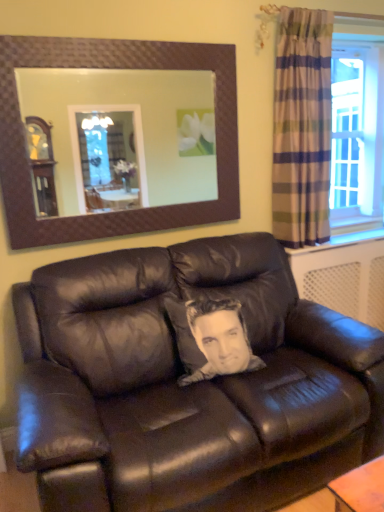
Question: Is brown textured mirror at upper center far away from plaid fabric curtain at right?

Choices:
 (A) no
 (B) yes

Answer: (B)

Question: Does brown textured mirror at upper center appear on the right side of plaid fabric curtain at right?

Choices:
 (A) yes
 (B) no

Answer: (B)

Question: Does brown textured mirror at upper center have a lesser height compared to plaid fabric curtain at right?

Choices:
 (A) yes
 (B) no

Answer: (A)

Question: Is brown textured mirror at upper center wider than plaid fabric curtain at right?

Choices:
 (A) no
 (B) yes

Answer: (A)

Question: Considering the relative positions of brown textured mirror at upper center and plaid fabric curtain at right in the image provided, is brown textured mirror at upper center in front of plaid fabric curtain at right?

Choices:
 (A) yes
 (B) no

Answer: (A)

Question: From the image's perspective, is brown textured mirror at upper center located above or below plaid fabric curtain at right?

Choices:
 (A) above
 (B) below

Answer: (B)

Question: Is brown textured mirror at upper center situated inside plaid fabric curtain at right or outside?

Choices:
 (A) outside
 (B) inside

Answer: (A)

Question: Visually, is brown textured mirror at upper center positioned to the left or to the right of plaid fabric curtain at right?

Choices:
 (A) right
 (B) left

Answer: (B)

Question: Is brown textured mirror at upper center wider or thinner than plaid fabric curtain at right?

Choices:
 (A) wide
 (B) thin

Answer: (B)

Question: From the image's perspective, relative to matte black leather couch at center, is brown textured mirror at upper center above or below?

Choices:
 (A) above
 (B) below

Answer: (A)

Question: Visually, is brown textured mirror at upper center positioned to the left or to the right of matte black leather couch at center?

Choices:
 (A) right
 (B) left

Answer: (B)

Question: Is brown textured mirror at upper center wider or thinner than matte black leather couch at center?

Choices:
 (A) thin
 (B) wide

Answer: (A)

Question: Is brown textured mirror at upper center taller or shorter than matte black leather couch at center?

Choices:
 (A) short
 (B) tall

Answer: (A)

Question: Is plaid fabric curtain at right in front of or behind matte black leather couch at center in the image?

Choices:
 (A) front
 (B) behind

Answer: (B)

Question: From their relative heights in the image, would you say plaid fabric curtain at right is taller or shorter than matte black leather couch at center?

Choices:
 (A) tall
 (B) short

Answer: (A)